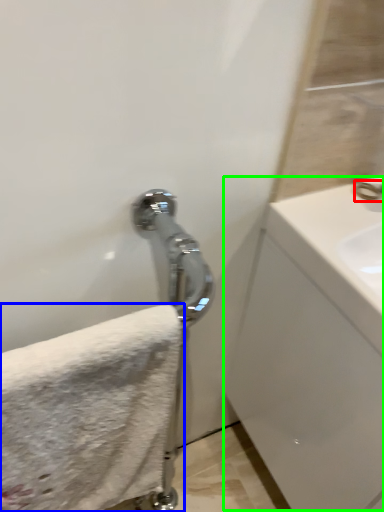
Question: Which object is positioned closest to faucet (highlighted by a red box)? Select from towel (highlighted by a blue box) and counter top (highlighted by a green box).

Choices:
 (A) towel
 (B) counter top

Answer: (B)